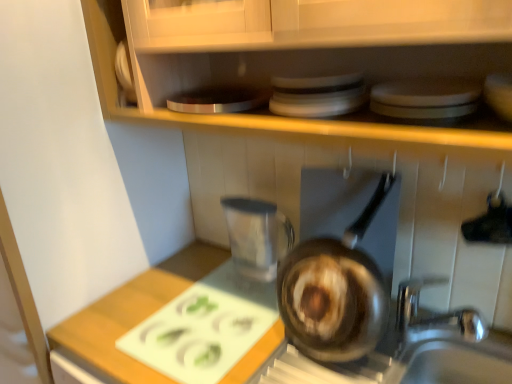
Image resolution: width=512 pixels, height=384 pixels. Find the location of `free spot in front of shiny brown frying pan at center`. free spot in front of shiny brown frying pan at center is located at coordinates (349, 362).